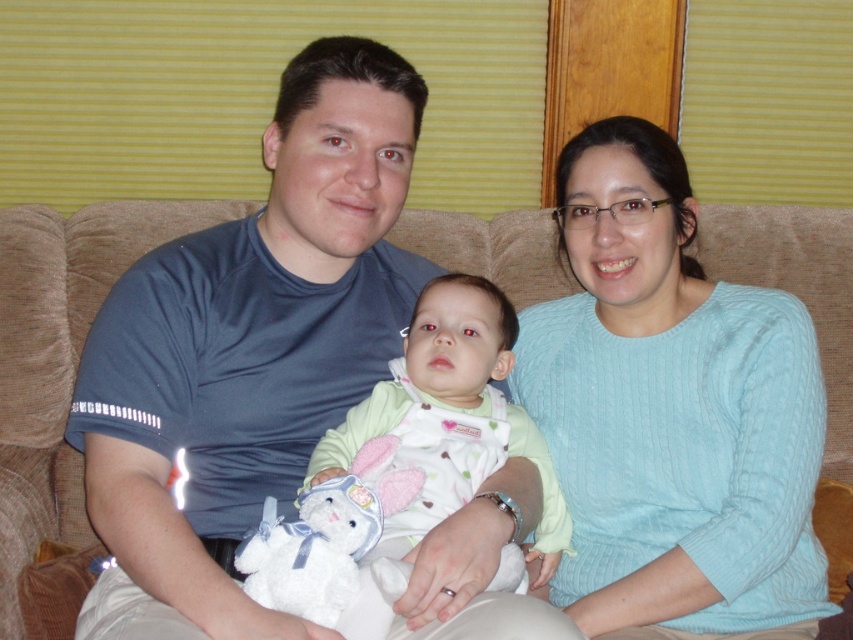
Between point (612, 518) and point (790, 288), which one is positioned behind?

The point (790, 288) is behind.

Locate an element on the screen. This screenshot has width=853, height=640. light blue knit sweater at center is located at coordinates (671, 412).

Can you confirm if blue cotton shirt at center is thinner than light blue knit sweater at center?

No.

Between point (273, 276) and point (763, 627), which one is positioned behind?

The point (273, 276) is behind.

The image size is (853, 640). I want to click on blue cotton shirt at center, so click(x=248, y=349).

Between point (39, 513) and point (483, 360), which one is positioned in front?

Point (483, 360) is more forward.

Is point (844, 218) more distant than point (474, 452)?

Yes, it is.

Who is more forward, (537, 250) or (431, 401)?

Point (431, 401)

At what (x,y) coordinates should I click in order to perform the action: click on beige fabric couch at center. Please return your answer as a coordinate pair (x, y). The height and width of the screenshot is (640, 853). Looking at the image, I should click on (59, 387).